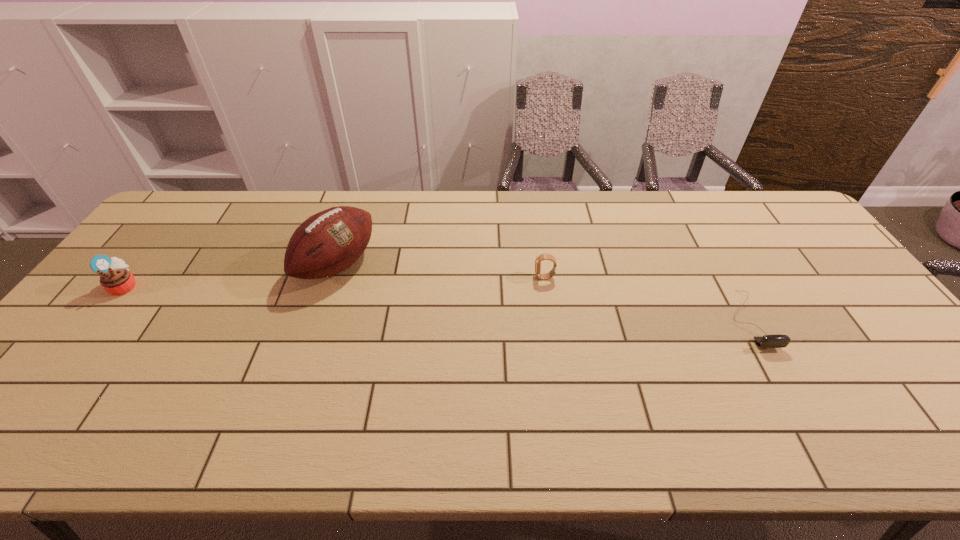
What are the coordinates of `the third object from right to left` in the screenshot? It's located at (328, 242).

Image resolution: width=960 pixels, height=540 pixels. Find the location of `football (American)`. football (American) is located at coordinates (328, 242).

This screenshot has width=960, height=540. I want to click on muffin, so click(x=116, y=279).

The image size is (960, 540). Find the location of `the leftmost object`. the leftmost object is located at coordinates (116, 279).

I want to click on the third tallest object, so click(x=545, y=256).

I want to click on the third object from left to right, so click(545, 256).

The height and width of the screenshot is (540, 960). I want to click on webcam, so click(768, 341).

Identify the location of the shortest object. (768, 341).

You are a GUI agent. You are given a task and a screenshot of the screen. Output one action in this format:
    pyautogui.click(x=<x>, y=<y>)
    Task: Click on the vacant space located on the front of the third object from right to left
    This screenshot has height=540, width=960.
    Given the screenshot: What is the action you would take?
    pyautogui.click(x=288, y=413)

Locate an element on the screen. vacant region located 0.140m on the front-facing side of the third shortest object is located at coordinates (186, 286).